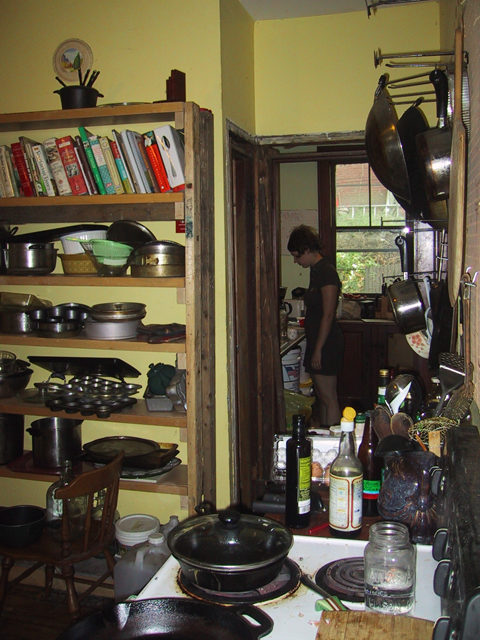
Locate an element on the screen. window is located at coordinates (376, 228).